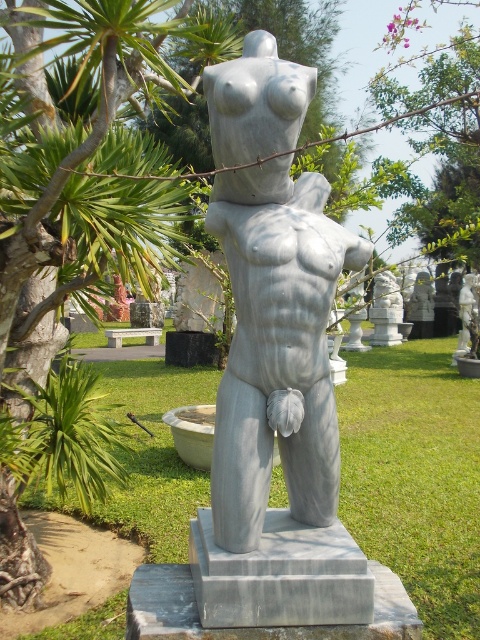
You are standing at the center of the garden facing the statue. Which direction should you turn to find the green leafy tree at left?

The green leafy tree at left is located at point (76, 198), which is to your left side. Since you are facing the statue at the center, turning to your left will allow you to see the green leafy tree at left.

You are standing in the garden and want to take a photo of both the green leafy tree at left and the white marble statue at center. Which object should you focus on first to ensure both are in frame?

You should focus on the green leafy tree at left first because it is closer to you than the white marble statue at center, so adjusting the camera to include it will also capture the statue in the background.

You are standing at the center of the garden looking towards the statue. There is a point marked at coordinates (x=76, y=198). What object is located at that point?

The point at coordinates (x=76, y=198) marks the location of the green leafy tree at left.